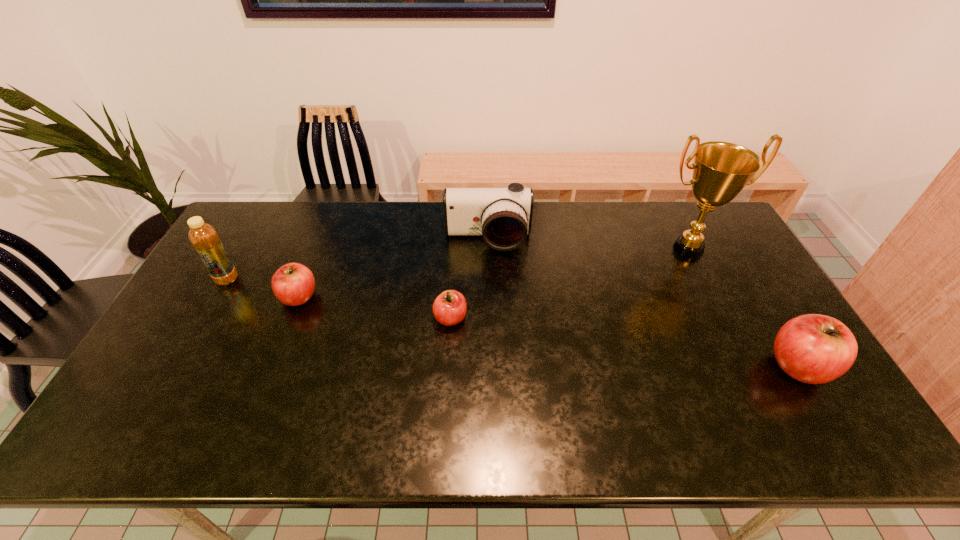
Locate an element on the screen. This screenshot has height=540, width=960. vacant point located on the front of the second shortest apple is located at coordinates (270, 372).

The width and height of the screenshot is (960, 540). Find the location of `free spot located 0.060m on the right of the second apple from left to right`. free spot located 0.060m on the right of the second apple from left to right is located at coordinates [x=488, y=318].

This screenshot has width=960, height=540. I want to click on free point located 0.350m on the back of the nearest apple, so click(x=732, y=255).

Locate an element on the screen. The height and width of the screenshot is (540, 960). vacant space situated 0.280m on the surface of the camcorder is located at coordinates (489, 321).

You are a GUI agent. You are given a task and a screenshot of the screen. Output one action in this format:
    pyautogui.click(x=<x>, y=<y>)
    Task: Click on the vacant space situated on the front view with handles of the award
    The height and width of the screenshot is (540, 960).
    Given the screenshot: What is the action you would take?
    pyautogui.click(x=742, y=355)

Where is `vacant space situated on the front of the bottle`? The image size is (960, 540). vacant space situated on the front of the bottle is located at coordinates (156, 403).

Where is `camcorder present at the far edge`? camcorder present at the far edge is located at coordinates (503, 216).

Image resolution: width=960 pixels, height=540 pixels. Identify the location of award at the far edge. (721, 170).

You are a GUI agent. You are given a task and a screenshot of the screen. Output one action in this format:
    pyautogui.click(x=<x>, y=<y>)
    Task: Click on the object at the near edge
    The image size is (960, 540).
    Given the screenshot: What is the action you would take?
    pyautogui.click(x=815, y=349)

The image size is (960, 540). I want to click on object that is positioned at the left edge, so click(204, 238).